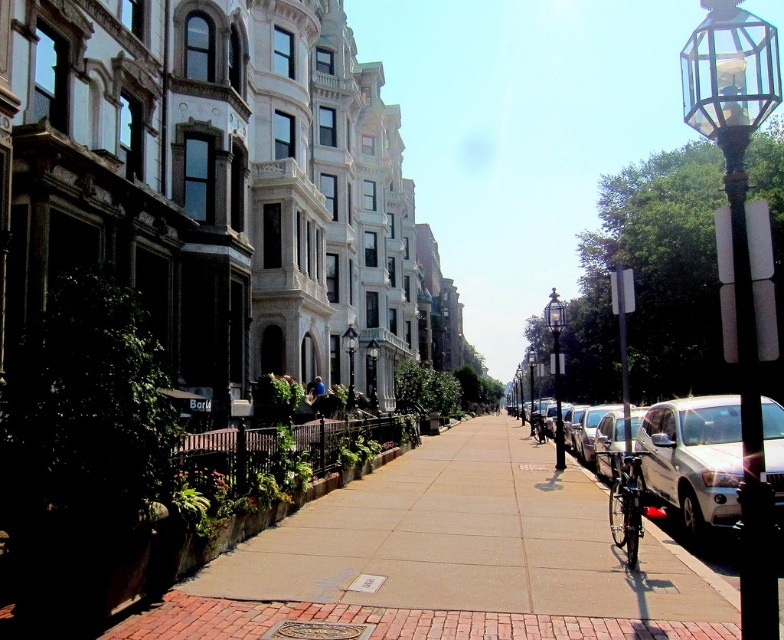
Is the position of smooth concrete sidewalk at center more distant than that of polished brass lamp post at center?

No, smooth concrete sidewalk at center is in front of polished brass lamp post at center.

In the scene shown: Is smooth concrete sidewalk at center shorter than polished brass lamp post at center?

Yes.

Does point (554, 497) come farther from viewer compared to point (349, 337)?

No, (554, 497) is in front of (349, 337).

The width and height of the screenshot is (784, 640). Identify the location of smooth concrete sidewalk at center. (449, 561).

Which is above, polished brass lamp post at center or polished brass streetlamp at center?

polished brass lamp post at center is above.

Is point (347, 397) closer to camera compared to point (376, 371)?

Yes, point (347, 397) is in front of point (376, 371).

Describe the element at coordinates (350, 362) in the screenshot. I see `polished brass lamp post at center` at that location.

Where is `polished brass lamp post at center`? polished brass lamp post at center is located at coordinates (350, 362).

Is smooth concrete sidewalk at center to the right of shiny metallic bicycle at lower right from the viewer's perspective?

No, smooth concrete sidewalk at center is not to the right of shiny metallic bicycle at lower right.

Between smooth concrete sidewalk at center and shiny metallic bicycle at lower right, which one is positioned higher?

shiny metallic bicycle at lower right

Is point (420, 618) behind point (619, 460)?

No, it is not.

What are the coordinates of `smooth concrete sidewalk at center` in the screenshot? It's located at (449, 561).